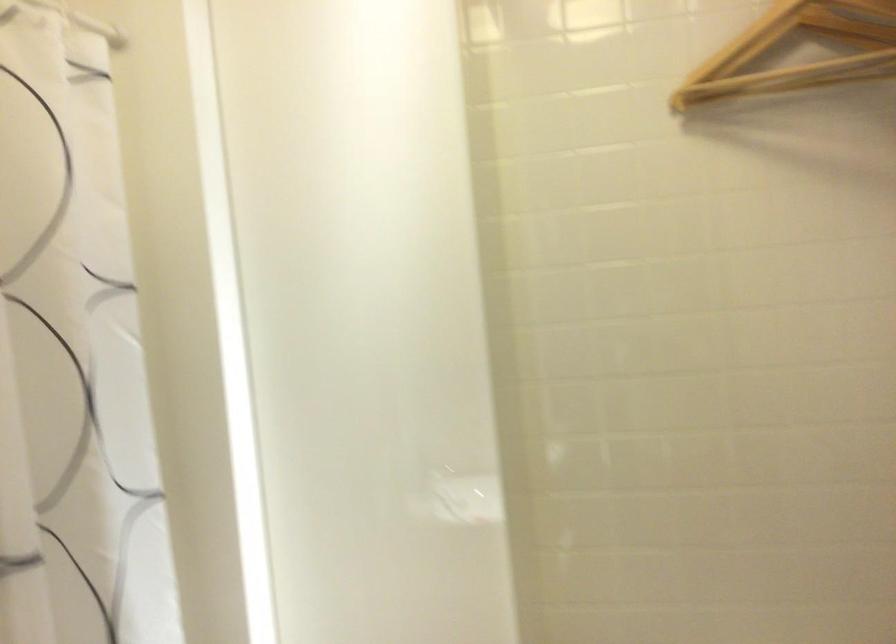
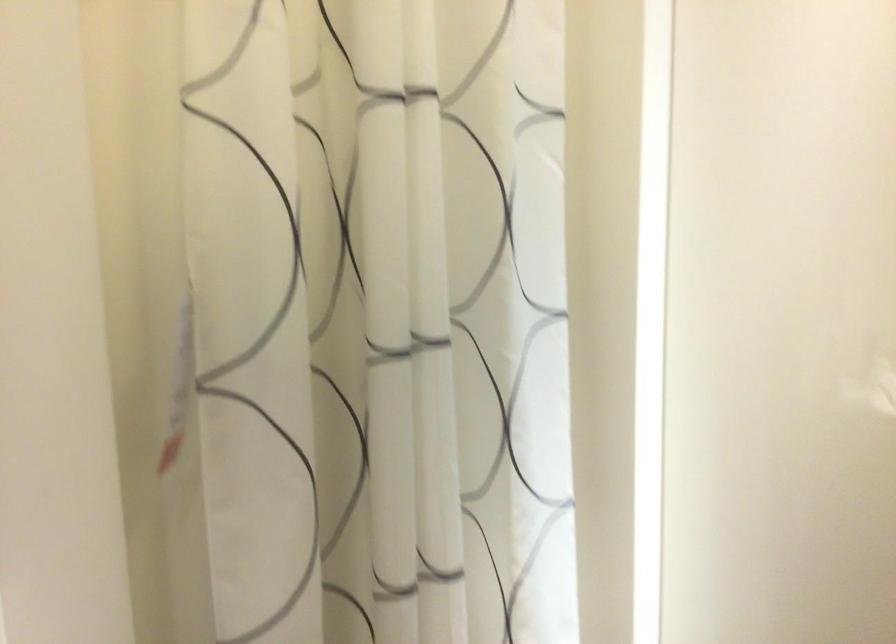
Question: The images are taken continuously from a first-person perspective. In which direction is your viewpoint rotating?

Choices:
 (A) Left
 (B) Right
 (C) Up
 (D) Down

Answer: (A)